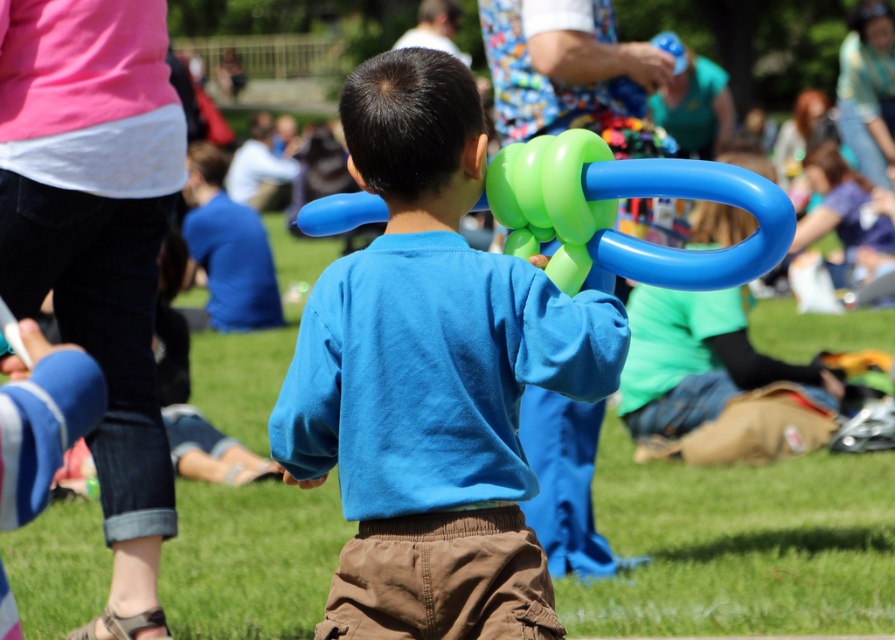
Between blue matte balloon at center and green rubber balloon at center, which one appears on the right side from the viewer's perspective?

green rubber balloon at center

At what (x,y) coordinates should I click in order to perform the action: click on blue matte balloon at center. Please return your answer as a coordinate pair (x, y). This screenshot has height=640, width=895. Looking at the image, I should click on (432, 376).